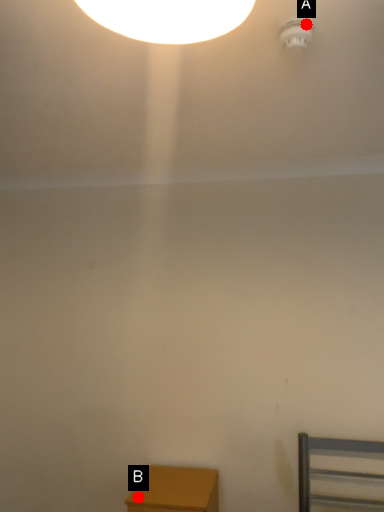
Question: Two points are circled on the image, labeled by A and B beside each circle. Which point appears farthest from the camera in this image?

Choices:
 (A) A is further
 (B) B is further

Answer: (B)